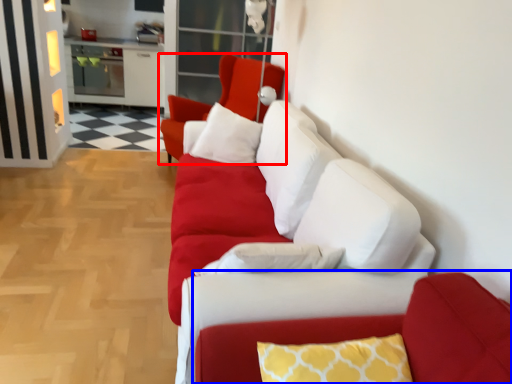
Question: Among these objects, which one is farthest to the camera, chair (highlighted by a red box) or couch (highlighted by a blue box)?

Choices:
 (A) chair
 (B) couch

Answer: (A)